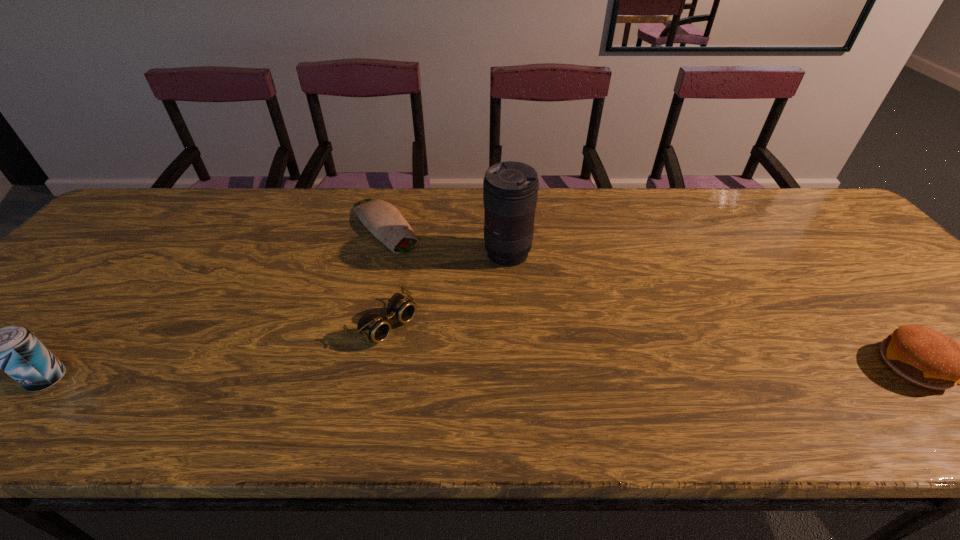
The height and width of the screenshot is (540, 960). I want to click on the leftmost object, so click(x=14, y=349).

Find the location of a particular element. The width and height of the screenshot is (960, 540). beer can is located at coordinates (14, 349).

Identify the location of the fourth object from left to right. (510, 189).

Where is `the tallest object`? The width and height of the screenshot is (960, 540). the tallest object is located at coordinates (510, 189).

At what (x,y) coordinates should I click in order to perform the action: click on burrito. Please return your answer as a coordinate pair (x, y). Looking at the image, I should click on (382, 219).

Identify the location of goggles. (373, 326).

You are a GUI agent. You are given a task and a screenshot of the screen. Output one action in this format:
    pyautogui.click(x=<x>, y=<y>)
    Task: Click on the vacant point located 0.120m on the right of the fourth shortest object
    This screenshot has width=960, height=540.
    Given the screenshot: What is the action you would take?
    [x=124, y=379]

You are a GUI agent. You are given a task and a screenshot of the screen. Output one action in this format:
    pyautogui.click(x=<x>, y=<y>)
    Task: Click on the free spot located on the side of the telephoto lens where the control switches are located
    The width and height of the screenshot is (960, 540).
    Given the screenshot: What is the action you would take?
    pyautogui.click(x=422, y=330)

Image resolution: width=960 pixels, height=540 pixels. I want to click on vacant space located on the side of the telephoto lens where the control switches are located, so click(426, 327).

What are the coordinates of `free location located 0.160m on the side of the telephoto lens where the control switches are located` in the screenshot? It's located at (454, 302).